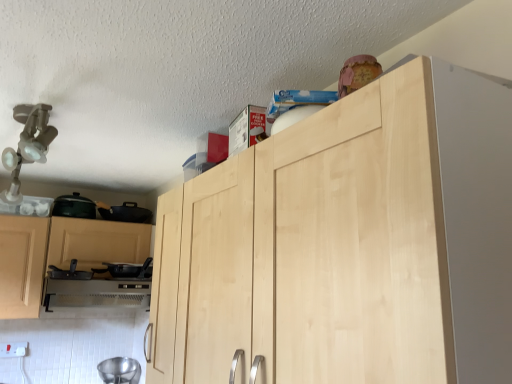
Question: Is the depth of natural wood cabinet at upper center less than that of metallic silver bowl at lower left, which appears as the fourth appliance when viewed from the top?

Choices:
 (A) yes
 (B) no

Answer: (A)

Question: Is natural wood cabinet at upper center to the left of metallic silver bowl at lower left, which appears as the 1th appliance when ordered from the bottom, from the viewer's perspective?

Choices:
 (A) no
 (B) yes

Answer: (A)

Question: Considering the relative sizes of natural wood cabinet at upper center and metallic silver bowl at lower left, which appears as the 1th appliance when ordered from the bottom, in the image provided, is natural wood cabinet at upper center shorter than metallic silver bowl at lower left, which appears as the 1th appliance when ordered from the bottom,?

Choices:
 (A) yes
 (B) no

Answer: (B)

Question: Does natural wood cabinet at upper center have a greater width compared to metallic silver bowl at lower left, which appears as the fourth appliance when viewed from the top?

Choices:
 (A) no
 (B) yes

Answer: (A)

Question: Is natural wood cabinet at upper center further to camera compared to metallic silver bowl at lower left, which appears as the 1th appliance when ordered from the bottom?

Choices:
 (A) no
 (B) yes

Answer: (A)

Question: Does point (112, 271) appear closer or farther from the camera than point (93, 213)?

Choices:
 (A) farther
 (B) closer

Answer: (B)

Question: Considering the positions of black matte pan at lower left, the second appliance from the bottom, and matte black pot at left, arranged as the 1th appliance when viewed from the top, in the image, is black matte pan at lower left, the second appliance from the bottom, wider or thinner than matte black pot at left, arranged as the 1th appliance when viewed from the top,?

Choices:
 (A) thin
 (B) wide

Answer: (B)

Question: Relative to matte black pot at left, which is counted as the fourth appliance, starting from the bottom, is black matte pan at lower left, the second appliance from the bottom, in front or behind?

Choices:
 (A) front
 (B) behind

Answer: (A)

Question: Looking at the image, does black matte pan at lower left, the second appliance from the bottom, seem bigger or smaller compared to matte black pot at left, which is counted as the fourth appliance, starting from the bottom?

Choices:
 (A) small
 (B) big

Answer: (B)

Question: Is black matte pan at lower left, the third appliance positioned from the bottom, in front of or behind matte black pot at left, arranged as the 1th appliance when viewed from the top, in the image?

Choices:
 (A) behind
 (B) front

Answer: (B)

Question: From the image's perspective, is black matte pan at lower left, the third appliance positioned from the bottom, located above or below matte black pot at left, arranged as the 1th appliance when viewed from the top?

Choices:
 (A) above
 (B) below

Answer: (B)

Question: Is point (68, 278) closer or farther from the camera than point (70, 213)?

Choices:
 (A) farther
 (B) closer

Answer: (B)

Question: From a real-world perspective, is black matte pan at lower left, the third appliance positioned from the bottom, above or below matte black pot at left, arranged as the 1th appliance when viewed from the top?

Choices:
 (A) above
 (B) below

Answer: (B)

Question: Visually, is black matte pan at lower left, positioned as the 2th appliance in top-to-bottom order, positioned to the left or to the right of black matte pan at lower left, the second appliance from the bottom?

Choices:
 (A) left
 (B) right

Answer: (A)

Question: Is black matte pan at lower left, positioned as the 2th appliance in top-to-bottom order, taller or shorter than black matte pan at lower left, the second appliance from the bottom?

Choices:
 (A) tall
 (B) short

Answer: (B)